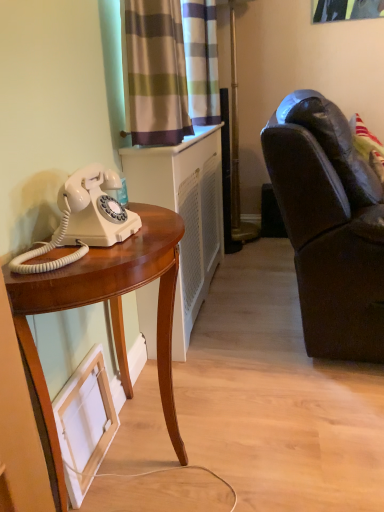
Question: Does dark brown leather couch at right appear on the left side of striped fabric curtain at upper center, acting as the first curtain starting from the front?

Choices:
 (A) no
 (B) yes

Answer: (A)

Question: Considering the relative sizes of dark brown leather couch at right and striped fabric curtain at upper center, positioned as the second curtain in back-to-front order, in the image provided, is dark brown leather couch at right taller than striped fabric curtain at upper center, positioned as the second curtain in back-to-front order,?

Choices:
 (A) no
 (B) yes

Answer: (B)

Question: Does dark brown leather couch at right have a lesser height compared to striped fabric curtain at upper center, positioned as the second curtain in back-to-front order?

Choices:
 (A) no
 (B) yes

Answer: (A)

Question: From the image's perspective, is dark brown leather couch at right under striped fabric curtain at upper center, acting as the first curtain starting from the front?

Choices:
 (A) yes
 (B) no

Answer: (A)

Question: Is dark brown leather couch at right positioned behind striped fabric curtain at upper center, acting as the first curtain starting from the front?

Choices:
 (A) yes
 (B) no

Answer: (B)

Question: Is dark brown leather couch at right wider than striped fabric curtain at upper center, acting as the first curtain starting from the front?

Choices:
 (A) yes
 (B) no

Answer: (A)

Question: Considering the relative positions of mahogany wood desk at left and white plastic radiator at center in the image provided, is mahogany wood desk at left to the right of white plastic radiator at center from the viewer's perspective?

Choices:
 (A) no
 (B) yes

Answer: (A)

Question: From the image's perspective, does mahogany wood desk at left appear higher than white plastic radiator at center?

Choices:
 (A) yes
 (B) no

Answer: (B)

Question: From the image's perspective, is mahogany wood desk at left below white plastic radiator at center?

Choices:
 (A) no
 (B) yes

Answer: (B)

Question: Is mahogany wood desk at left positioned with its back to white plastic radiator at center?

Choices:
 (A) yes
 (B) no

Answer: (B)

Question: Does mahogany wood desk at left have a lesser width compared to white plastic radiator at center?

Choices:
 (A) no
 (B) yes

Answer: (A)

Question: Is mahogany wood desk at left not close to white plastic radiator at center?

Choices:
 (A) no
 (B) yes

Answer: (A)

Question: Is white plastic radiator at center completely or partially outside of white matte picture frame at lower left?

Choices:
 (A) yes
 (B) no

Answer: (A)